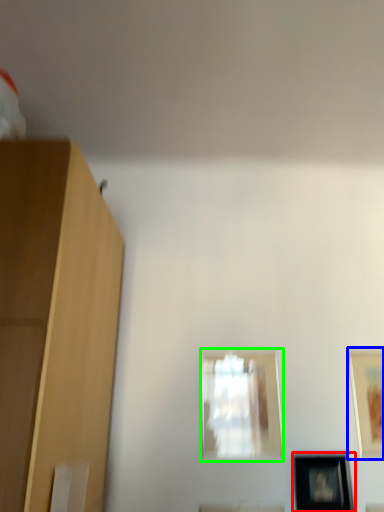
Question: Which is nearer to the picture frame (highlighted by a red box)? picture frame (highlighted by a blue box) or picture frame (highlighted by a green box).

Choices:
 (A) picture frame
 (B) picture frame

Answer: (A)